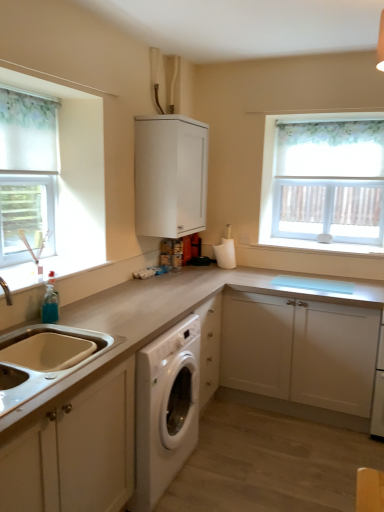
At what (x,y) coordinates should I click in order to perform the action: click on free space in front of white matte toilet paper holder at center. Please return your answer as a coordinate pair (x, y). Looking at the image, I should click on (225, 273).